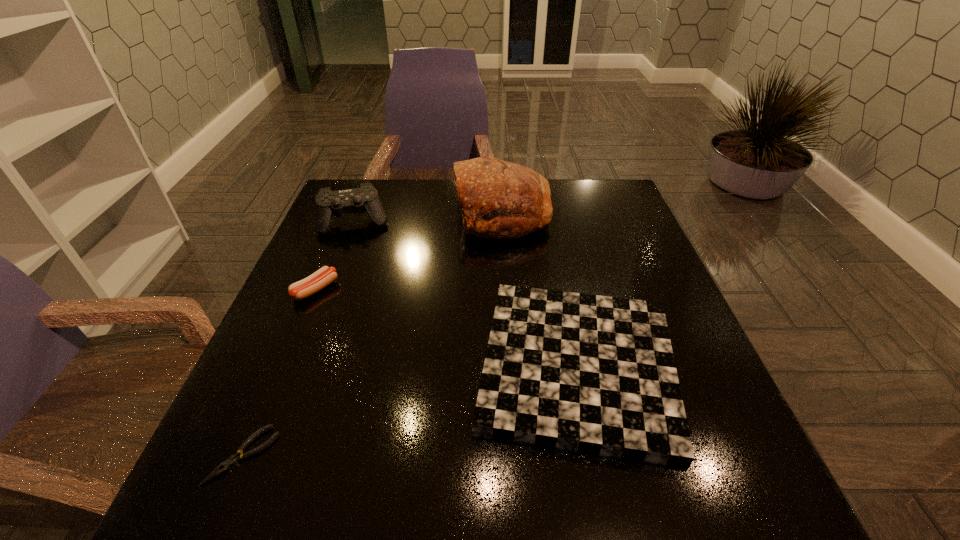
The image size is (960, 540). Identify the location of the tallest object. (498, 199).

Where is `control`? control is located at coordinates (328, 204).

Locate an element on the screen. The image size is (960, 540). sausage is located at coordinates (312, 284).

Locate an element on the screen. checkerboard is located at coordinates (594, 374).

The image size is (960, 540). I want to click on pliers, so click(234, 459).

Locate an element on the screen. free spot located at the sliced front of the tallest object is located at coordinates (388, 213).

Locate an element on the screen. This screenshot has height=540, width=960. vacant space located at the sliced front of the tallest object is located at coordinates (349, 213).

Locate an element on the screen. vacant area situated at the sliced front of the tallest object is located at coordinates [405, 213].

At what (x,y) coordinates should I click in order to perform the action: click on free region located 0.140m on the front of the fourth shortest object. Please return your answer as a coordinate pair (x, y). This screenshot has width=960, height=540. Looking at the image, I should click on (337, 271).

Where is `free space located 0.250m on the right of the sausage`? free space located 0.250m on the right of the sausage is located at coordinates (445, 289).